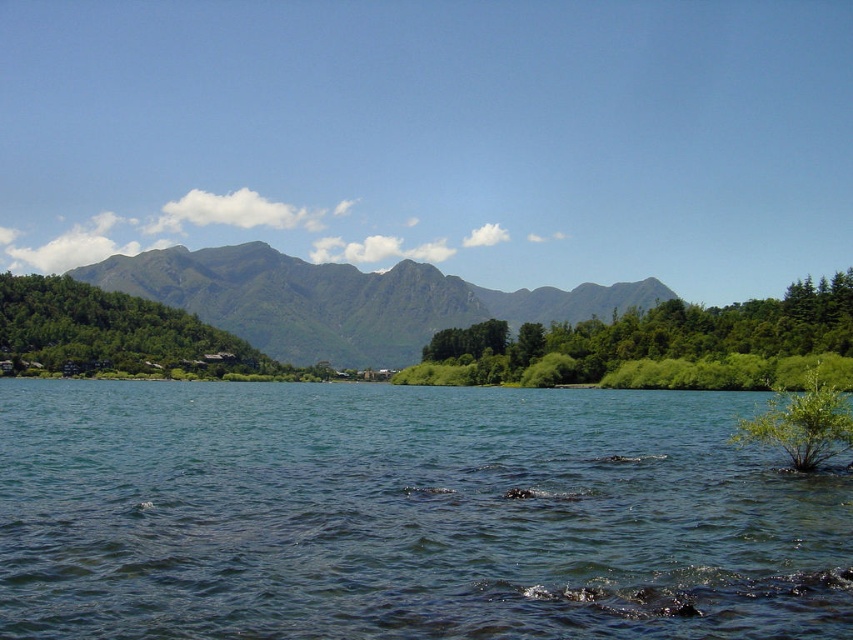
You are standing on the green leafy hillside at left and want to reach the clear blue water at center. Which direction should you walk to get there?

You should walk to the right because the clear blue water at center is located to the right of the green leafy hillside at left.

You are a hiker planning a route from the green leafy hillside at left to the green textured mountain at center. Based on the distance provided, is this a short walk or a long hike?

The green textured mountain at center is 132.40 meters away from the green leafy hillside at left. This distance suggests it is a short walk between the two locations.